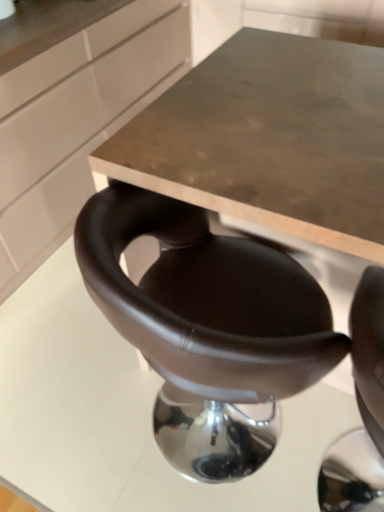
Looking at this image, what is the approximate width of brown leather chair at center?

brown leather chair at center is 4.85 feet in width.

This screenshot has width=384, height=512. Describe the element at coordinates (208, 326) in the screenshot. I see `brown leather chair at center` at that location.

Locate an element on the screen. This screenshot has height=512, width=384. brown leather chair at center is located at coordinates (208, 326).

Locate an element on the screen. This screenshot has width=384, height=512. matte white cabinet at upper left is located at coordinates (76, 122).

Describe the element at coordinates (76, 122) in the screenshot. The image size is (384, 512). I see `matte white cabinet at upper left` at that location.

What is the approximate height of matte white cabinet at upper left?

It is 89.61 centimeters.

The width and height of the screenshot is (384, 512). I want to click on brown leather chair at center, so click(x=208, y=326).

Between brown leather chair at center and matte white cabinet at upper left, which one appears on the left side from the viewer's perspective?

matte white cabinet at upper left is more to the left.

Is brown leather chair at center further to the viewer compared to matte white cabinet at upper left?

No, the depth of brown leather chair at center is less than that of matte white cabinet at upper left.

Which is farther, (x=190, y=325) or (x=21, y=245)?

Positioned behind is point (x=21, y=245).

From the image's perspective, between brown leather chair at center and matte white cabinet at upper left, who is located below?

brown leather chair at center is shown below in the image.

From a real-world perspective, is brown leather chair at center positioned above or below matte white cabinet at upper left?

Clearly, from a real-world perspective, brown leather chair at center is below matte white cabinet at upper left.

In terms of width, does brown leather chair at center look wider or thinner when compared to matte white cabinet at upper left?

brown leather chair at center is wider than matte white cabinet at upper left.

Does brown leather chair at center have a greater height compared to matte white cabinet at upper left?

In fact, brown leather chair at center may be shorter than matte white cabinet at upper left.

Does brown leather chair at center have a larger size compared to matte white cabinet at upper left?

Actually, brown leather chair at center might be smaller than matte white cabinet at upper left.

Looking at this image, do you think brown leather chair at center is within matte white cabinet at upper left, or outside of it?

brown leather chair at center is outside matte white cabinet at upper left.

Can you see brown leather chair at center touching matte white cabinet at upper left?

No, brown leather chair at center is not next to matte white cabinet at upper left.

Is brown leather chair at center turned away from matte white cabinet at upper left?

No, brown leather chair at center is not facing the opposite direction of matte white cabinet at upper left.

How different are the orientations of brown leather chair at center and matte white cabinet at upper left in degrees?

The angle between the facing direction of brown leather chair at center and the facing direction of matte white cabinet at upper left is 90.1 degrees.

This screenshot has height=512, width=384. In the image, there is a matte white cabinet at upper left. What are the coordinates of `chair below it (from a real-world perspective)` in the screenshot? It's located at (208, 326).

Visually, is matte white cabinet at upper left positioned to the left or to the right of brown leather chair at center?

Based on their positions, matte white cabinet at upper left is located to the left of brown leather chair at center.

Does matte white cabinet at upper left lie behind brown leather chair at center?

Yes.

Is point (75, 151) positioned before point (299, 378)?

No, it is behind (299, 378).

From the image's perspective, between matte white cabinet at upper left and brown leather chair at center, which one is located above?

From the image's view, matte white cabinet at upper left is above.

From a real-world perspective, is matte white cabinet at upper left under brown leather chair at center?

Actually, matte white cabinet at upper left is physically above brown leather chair at center in the real world.

Which object is thinner, matte white cabinet at upper left or brown leather chair at center?

Thinner between the two is matte white cabinet at upper left.

Is matte white cabinet at upper left shorter than brown leather chair at center?

Incorrect, the height of matte white cabinet at upper left does not fall short of that of brown leather chair at center.

Who is bigger, matte white cabinet at upper left or brown leather chair at center?

With larger size is matte white cabinet at upper left.

Is matte white cabinet at upper left spatially inside brown leather chair at center, or outside of it?

matte white cabinet at upper left is not inside brown leather chair at center, it's outside.

Is matte white cabinet at upper left with brown leather chair at center?

matte white cabinet at upper left and brown leather chair at center are not in contact.

Is matte white cabinet at upper left turned away from brown leather chair at center?

No.

What's the angular difference between matte white cabinet at upper left and brown leather chair at center's facing directions?

The facing directions of matte white cabinet at upper left and brown leather chair at center are 90.1 degrees apart.

How distant is matte white cabinet at upper left from brown leather chair at center?

The distance of matte white cabinet at upper left from brown leather chair at center is 1.01 meters.

The width and height of the screenshot is (384, 512). In order to click on chair that is below the matte white cabinet at upper left (from the image's perspective) in this screenshot , I will do point(208,326).

This screenshot has height=512, width=384. What are the coordinates of `cabinetry on the left of brown leather chair at center` in the screenshot? It's located at (76, 122).

At what (x,y) coordinates should I click in order to perform the action: click on chair in front of the matte white cabinet at upper left. Please return your answer as a coordinate pair (x, y). This screenshot has width=384, height=512. Looking at the image, I should click on (208, 326).